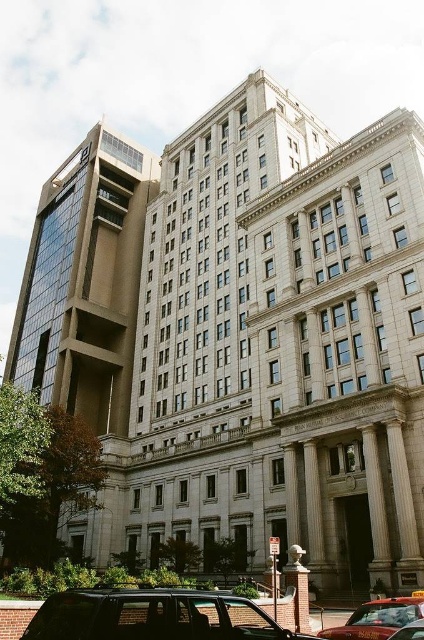
Question: Which object appears closest to the camera in this image?

Choices:
 (A) matte black suv at lower center
 (B) red metallic taxi cab at lower center

Answer: (A)

Question: Does red metallic taxi cab at lower center have a smaller size compared to metallic silver taxi at lower right?

Choices:
 (A) yes
 (B) no

Answer: (B)

Question: Among these objects, which one is farthest from the camera?

Choices:
 (A) metallic silver taxi at lower right
 (B) red metallic taxi cab at lower center
 (C) matte black suv at lower center

Answer: (B)

Question: Among these points, which one is nearest to the camera?

Choices:
 (A) (399, 637)
 (B) (396, 611)

Answer: (A)

Question: Does red metallic taxi cab at lower center have a smaller size compared to metallic silver taxi at lower right?

Choices:
 (A) yes
 (B) no

Answer: (B)

Question: Is matte black suv at lower center bigger than metallic silver taxi at lower right?

Choices:
 (A) yes
 (B) no

Answer: (A)